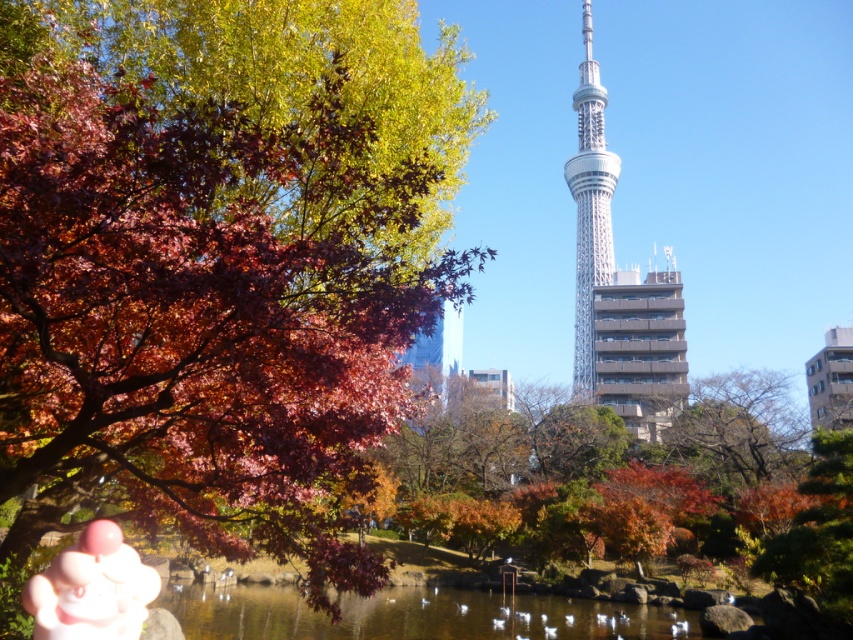
Does matte red maple tree at left lie in front of transparent water at center?

Yes, it is in front of transparent water at center.

Who is higher up, matte red maple tree at left or transparent water at center?

Positioned higher is matte red maple tree at left.

Between point (119, 88) and point (691, 621), which one is positioned behind?

Positioned behind is point (691, 621).

Image resolution: width=853 pixels, height=640 pixels. Identify the location of matte red maple tree at left. (219, 262).

Can you confirm if matte red maple tree at left is bigger than pink rubber hand at lower left?

Yes, matte red maple tree at left is bigger than pink rubber hand at lower left.

This screenshot has width=853, height=640. Identify the location of matte red maple tree at left. (219, 262).

Is transparent water at center closer to the viewer compared to pink rubber hand at lower left?

That is False.

Does point (621, 632) lie behind point (74, 627)?

Yes, it is.

Where is `transparent water at center`? transparent water at center is located at coordinates (415, 614).